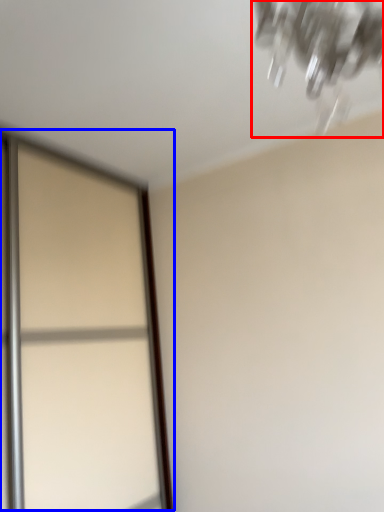
Question: Which point is closer to the camera, lamp (highlighted by a red box) or screen door (highlighted by a blue box)?

Choices:
 (A) lamp
 (B) screen door

Answer: (A)